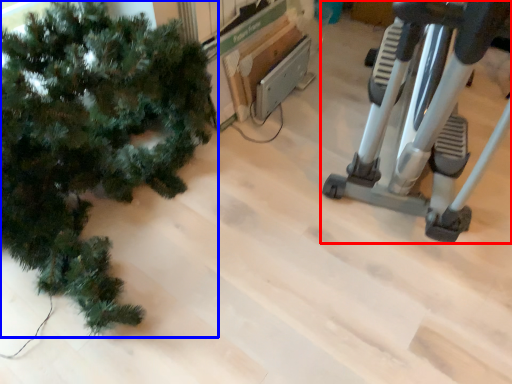
Question: Which point is closer to the camera, stationary bicycle (highlighted by a red box) or christmas tree (highlighted by a blue box)?

Choices:
 (A) stationary bicycle
 (B) christmas tree

Answer: (A)